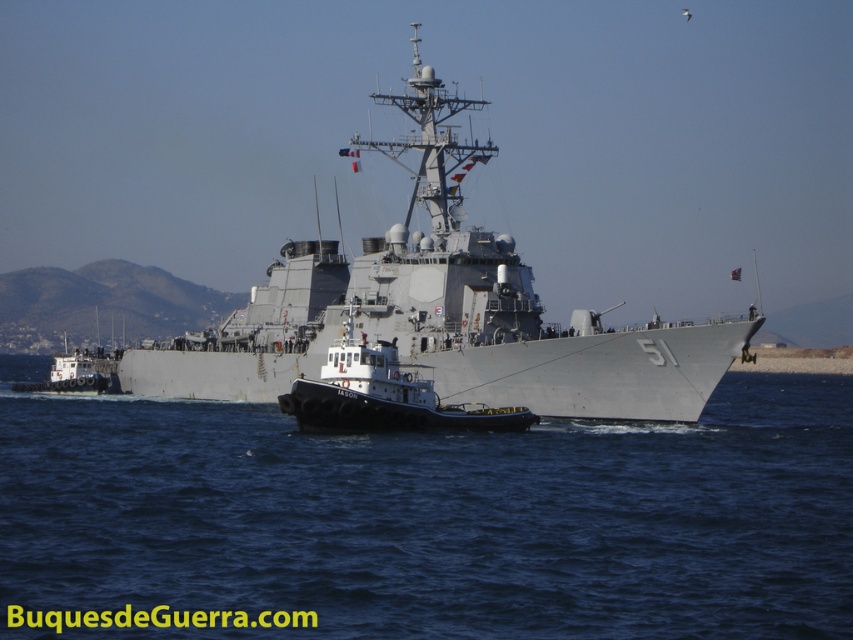
Between gray water at center and gray metallic warship at center, which one is positioned lower?

gray water at center

Can you confirm if gray water at center is positioned to the right of gray metallic warship at center?

In fact, gray water at center is to the left of gray metallic warship at center.

The width and height of the screenshot is (853, 640). Find the location of `gray water at center`. gray water at center is located at coordinates pos(431,518).

Is the position of gray metallic warship at center less distant than that of black rubber tugboat at center?

No, gray metallic warship at center is behind black rubber tugboat at center.

Identify the location of gray metallic warship at center. (440, 308).

The height and width of the screenshot is (640, 853). What do you see at coordinates (440, 308) in the screenshot?
I see `gray metallic warship at center` at bounding box center [440, 308].

The image size is (853, 640). Find the location of `gray metallic warship at center`. gray metallic warship at center is located at coordinates (440, 308).

Is gray water at center above black rubber tugboat at center?

Incorrect, gray water at center is not positioned above black rubber tugboat at center.

Which of these two, gray water at center or black rubber tugboat at center, stands shorter?

With less height is gray water at center.

The width and height of the screenshot is (853, 640). In order to click on gray water at center in this screenshot , I will do point(431,518).